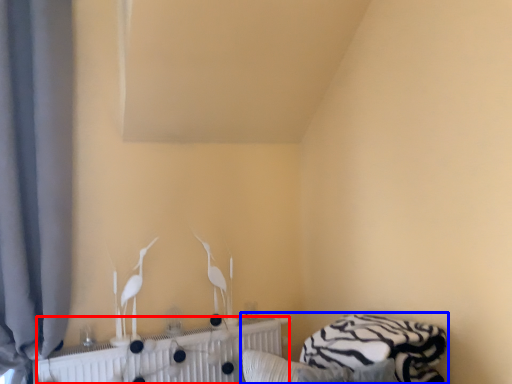
Question: Among these objects, which one is nearest to the camera, radiator (highlighted by a red box) or bed (highlighted by a blue box)?

Choices:
 (A) radiator
 (B) bed

Answer: (B)